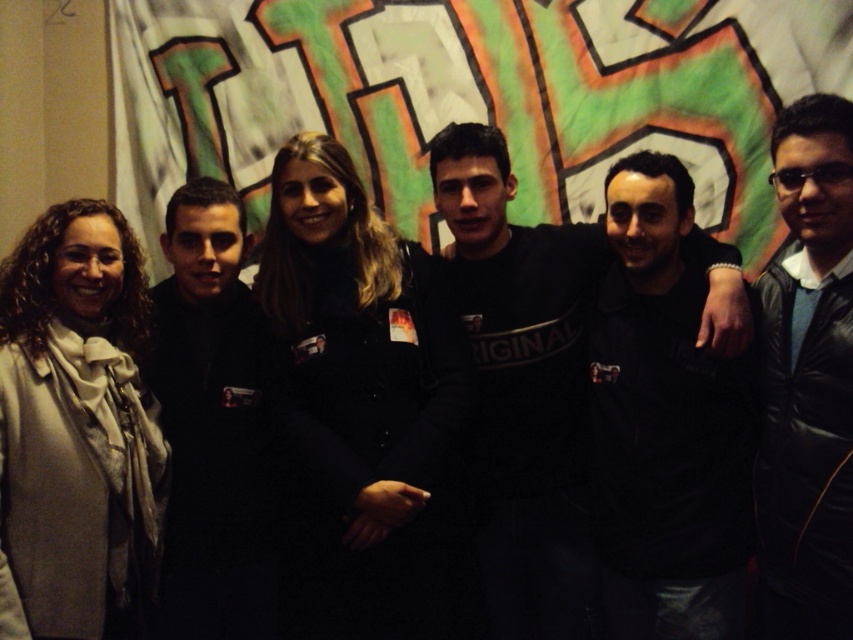
Is white soft scarf at left above black matte shirt at center?

No, white soft scarf at left is not above black matte shirt at center.

Describe the element at coordinates (74, 426) in the screenshot. I see `white soft scarf at left` at that location.

Who is more forward, (x=32, y=589) or (x=497, y=554)?

Point (x=32, y=589) is more forward.

Image resolution: width=853 pixels, height=640 pixels. In order to click on white soft scarf at left in this screenshot , I will do `click(74, 426)`.

Can you confirm if white soft scarf at left is positioned below black matte jacket at left?

No.

Does white soft scarf at left have a greater width compared to black matte jacket at left?

Yes, white soft scarf at left is wider than black matte jacket at left.

Which is behind, point (3, 369) or point (274, 586)?

Positioned behind is point (274, 586).

Locate an element on the screen. Image resolution: width=853 pixels, height=640 pixels. white soft scarf at left is located at coordinates (74, 426).

Is black leather jacket at right above black matte jacket at left?

Yes.

Does point (822, 448) come closer to viewer compared to point (190, 189)?

That is True.

Find the location of `black leather jacket at right`. black leather jacket at right is located at coordinates (807, 380).